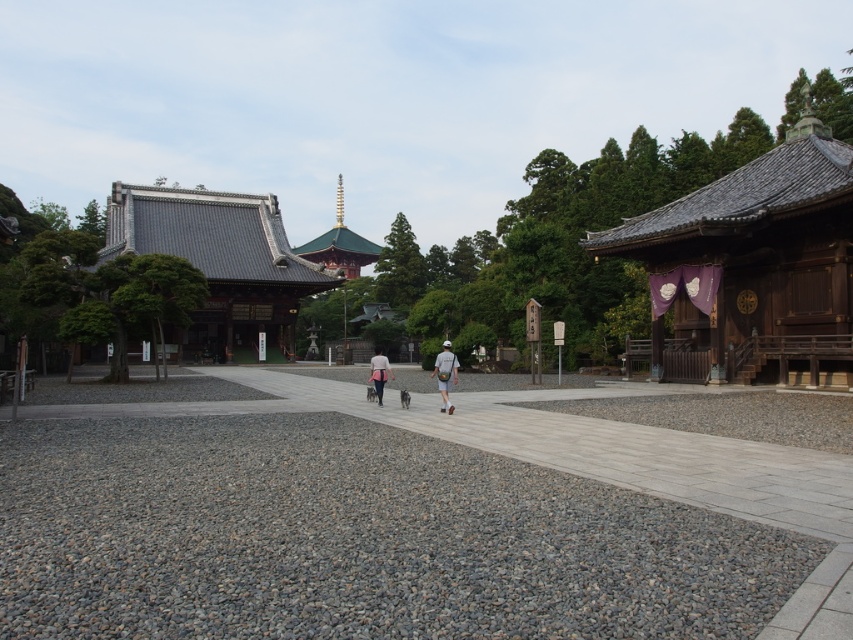
Which is in front, point (845, 504) or point (433, 369)?

Point (845, 504) is in front.

Can you confirm if gray gravel path at center is positioned above light gray fabric backpack at center?

Actually, gray gravel path at center is below light gray fabric backpack at center.

Between point (399, 412) and point (444, 349), which one is positioned in front?

Point (399, 412) is in front.

At what (x,y) coordinates should I click in order to perform the action: click on gray gravel path at center. Please return your answer as a coordinate pair (x, y). The image size is (853, 640). Looking at the image, I should click on (602, 449).

Is light gray fabric backpack at center behind light gray fabric bag at center?

No, it is not.

This screenshot has height=640, width=853. Identify the location of light gray fabric backpack at center. (445, 374).

Who is more distant from viewer, (440, 394) or (456, 364)?

Point (440, 394)

Is matte gray dog at center bigger than light gray fabric backpack at center?

Yes, matte gray dog at center is bigger than light gray fabric backpack at center.

Is point (444, 378) positioned after point (440, 392)?

No, (444, 378) is in front of (440, 392).

The image size is (853, 640). Find the location of `matte gray dog at center`. matte gray dog at center is located at coordinates (445, 374).